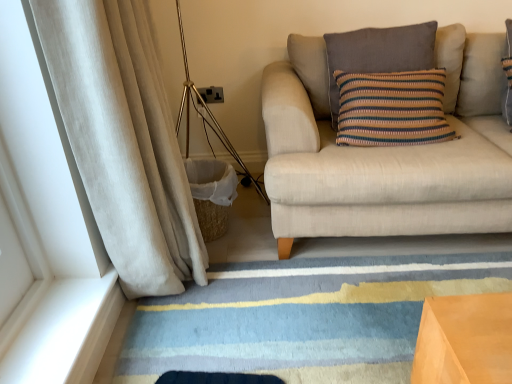
What are the coordinates of `free point in front of beige corduroy curtain at left` in the screenshot? It's located at (192, 340).